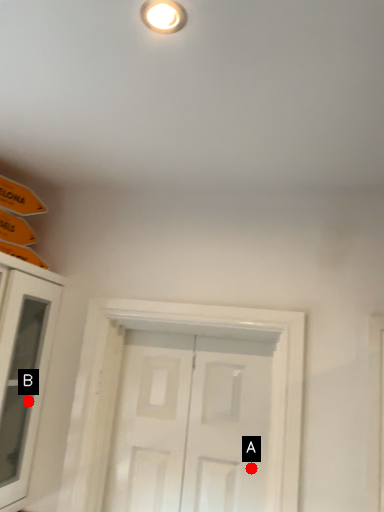
Question: Two points are circled on the image, labeled by A and B beside each circle. Which point is farther to the camera?

Choices:
 (A) A is further
 (B) B is further

Answer: (B)